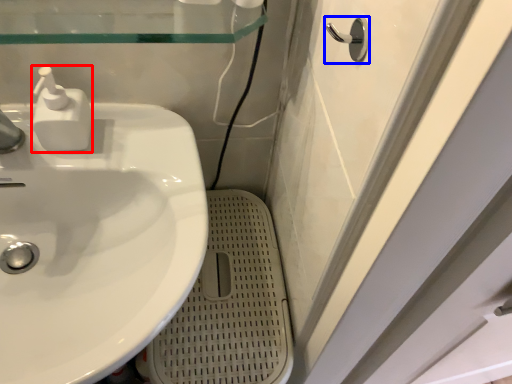
Question: Which point is closer to the camera, soap dispenser (highlighted by a red box) or door handle (highlighted by a blue box)?

Choices:
 (A) soap dispenser
 (B) door handle

Answer: (B)